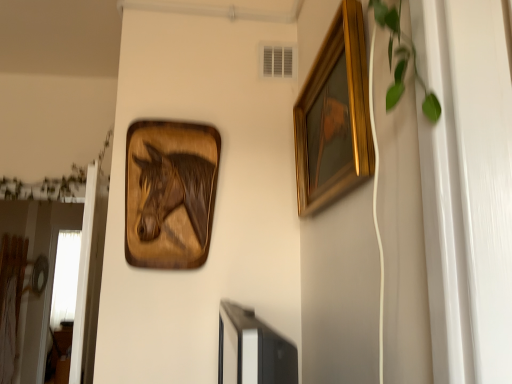
Question: In the image, is gold wooden picture frame at upper right on the left side or the right side of wooden horse at upper left?

Choices:
 (A) left
 (B) right

Answer: (B)

Question: From a real-world perspective, is gold wooden picture frame at upper right positioned above or below wooden horse at upper left?

Choices:
 (A) above
 (B) below

Answer: (A)

Question: Estimate the real-world distances between objects in this image. Which object is closer to the wooden horse at upper left?

Choices:
 (A) green leafy plant at upper right
 (B) gold wooden picture frame at upper right

Answer: (B)

Question: Estimate the real-world distances between objects in this image. Which object is farther from the gold wooden picture frame at upper right?

Choices:
 (A) green leafy plant at upper right
 (B) wooden horse at upper left

Answer: (B)